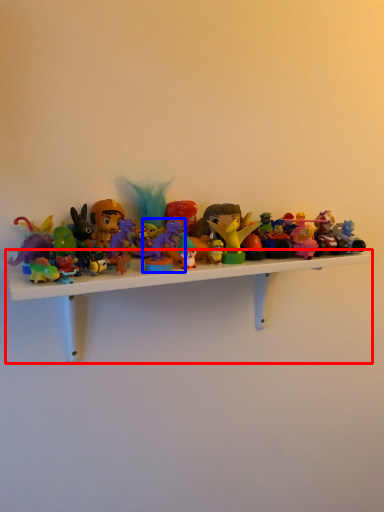
Question: Which point is further to the camera, shelf (highlighted by a red box) or toy (highlighted by a blue box)?

Choices:
 (A) shelf
 (B) toy

Answer: (B)